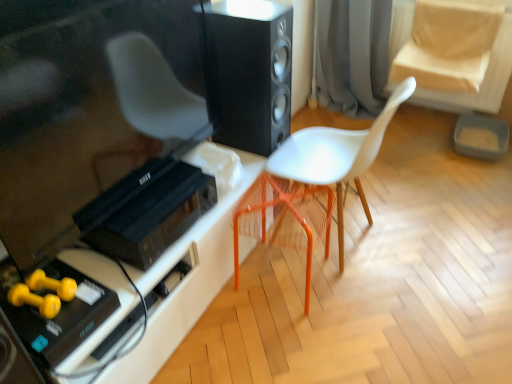
The image size is (512, 384). What are the coordinates of `vacant space to the right of orange plastic swivel chair at center` in the screenshot? It's located at (366, 296).